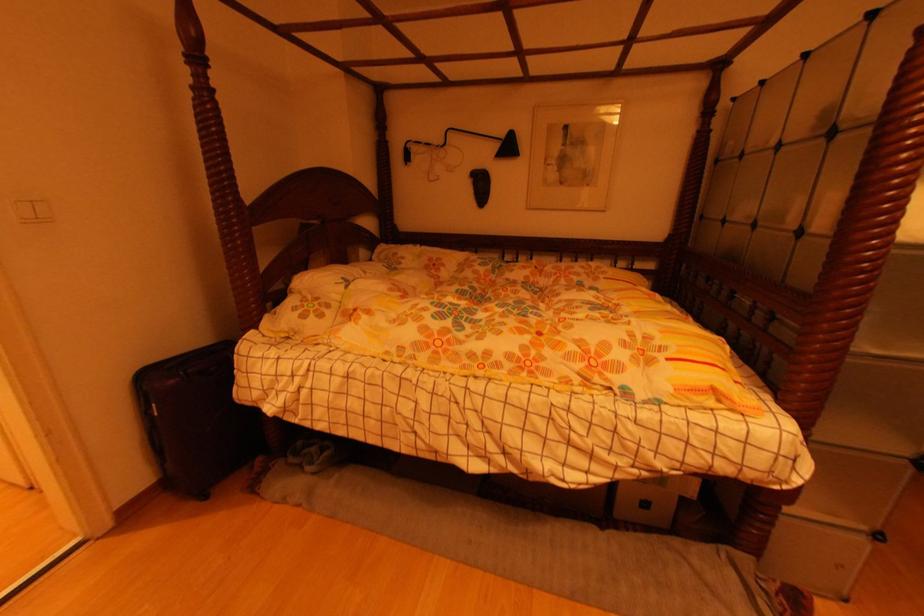
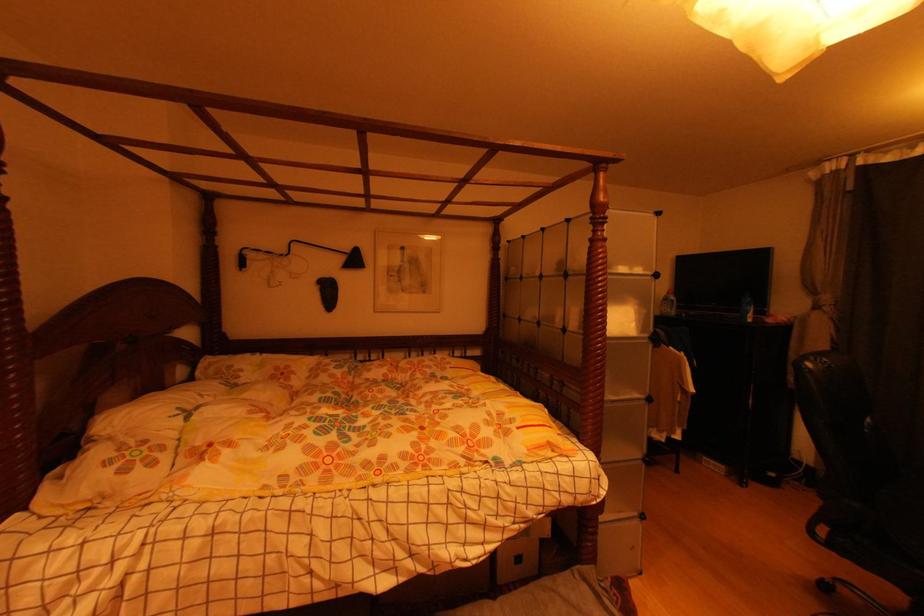
Find the pixel in the second image that matches (x=613, y=480) in the first image.

(504, 545)